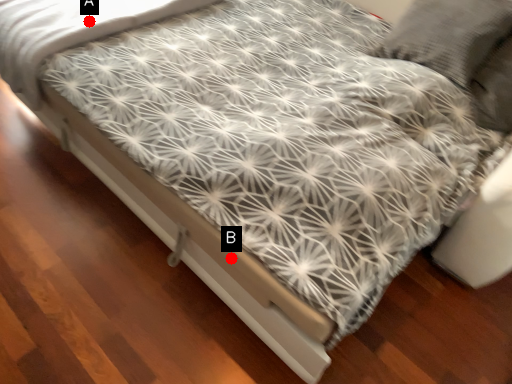
Question: Two points are circled on the image, labeled by A and B beside each circle. Which point is farther from the camera taking this photo?

Choices:
 (A) A is further
 (B) B is further

Answer: (A)